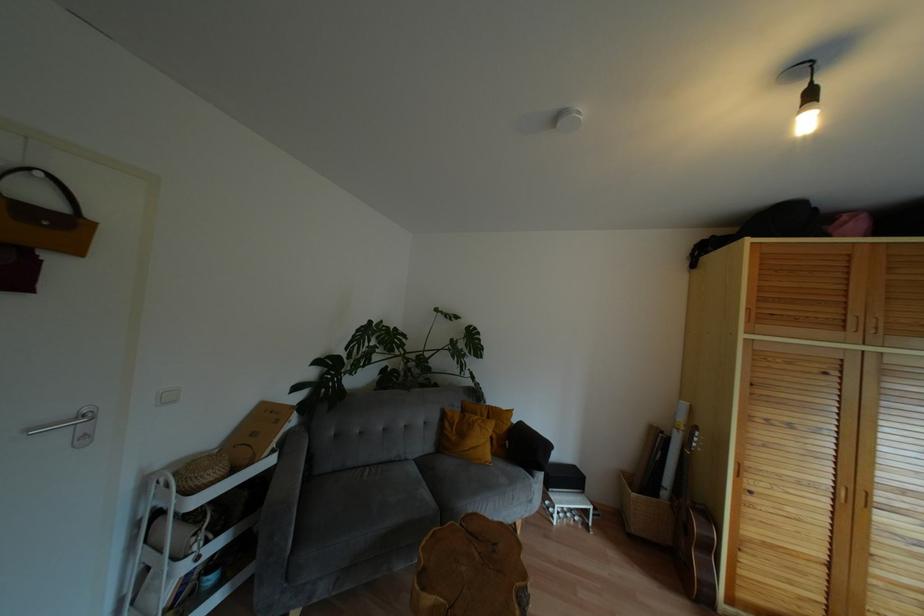
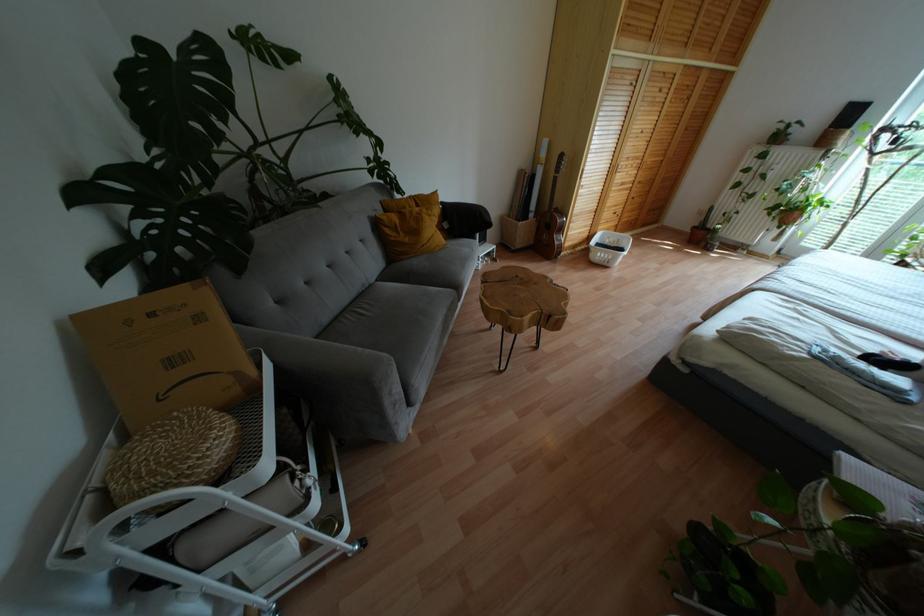
Find the pixel in the second image that matches the point at 488,456 in the first image.

(443, 240)